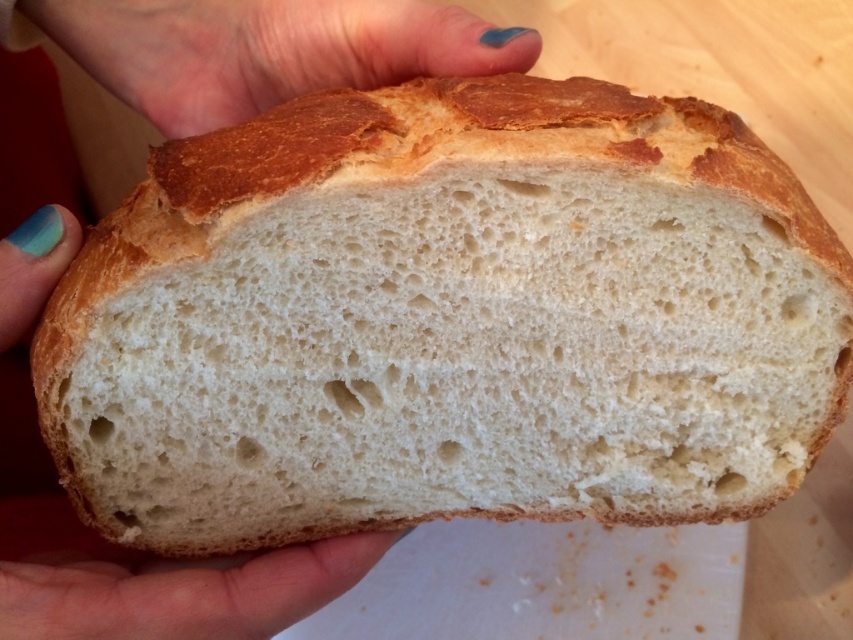
Question: Which of these objects is positioned farthest from the teal nail polish at upper center?

Choices:
 (A) teal matte nail polish at upper left
 (B) golden brown crusty bread at center

Answer: (A)

Question: Which object is farther from the camera taking this photo?

Choices:
 (A) teal matte nail polish at upper left
 (B) teal nail polish at upper center
 (C) golden brown crusty bread at center

Answer: (B)

Question: Which object appears closest to the camera in this image?

Choices:
 (A) teal nail polish at upper center
 (B) teal matte nail polish at upper left
 (C) golden brown crusty bread at center

Answer: (C)

Question: From the image, what is the correct spatial relationship of golden brown crusty bread at center in relation to teal matte nail polish at upper left?

Choices:
 (A) above
 (B) below

Answer: (A)

Question: Does golden brown crusty bread at center have a larger size compared to teal matte nail polish at upper left?

Choices:
 (A) no
 (B) yes

Answer: (B)

Question: Can you confirm if golden brown crusty bread at center is positioned below teal nail polish at upper center?

Choices:
 (A) yes
 (B) no

Answer: (A)